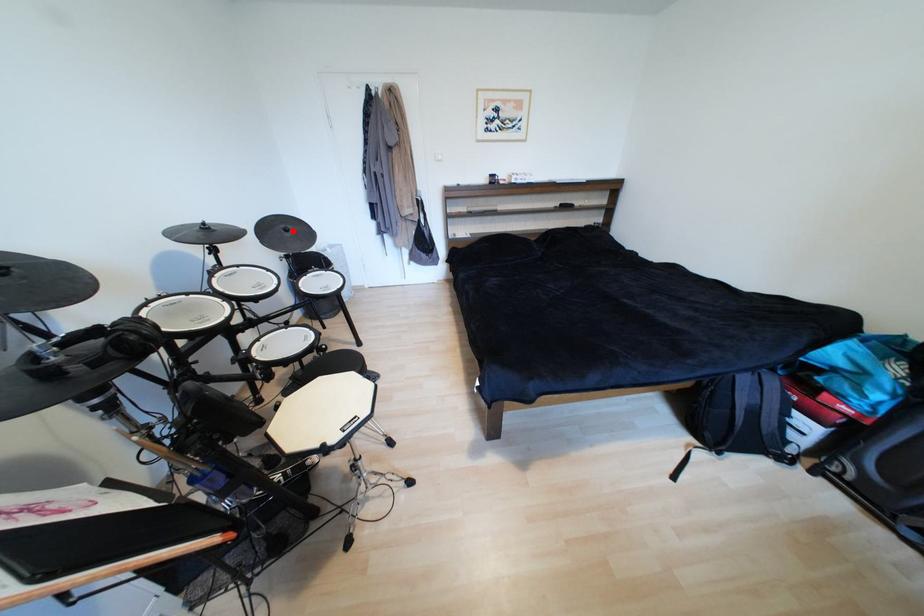
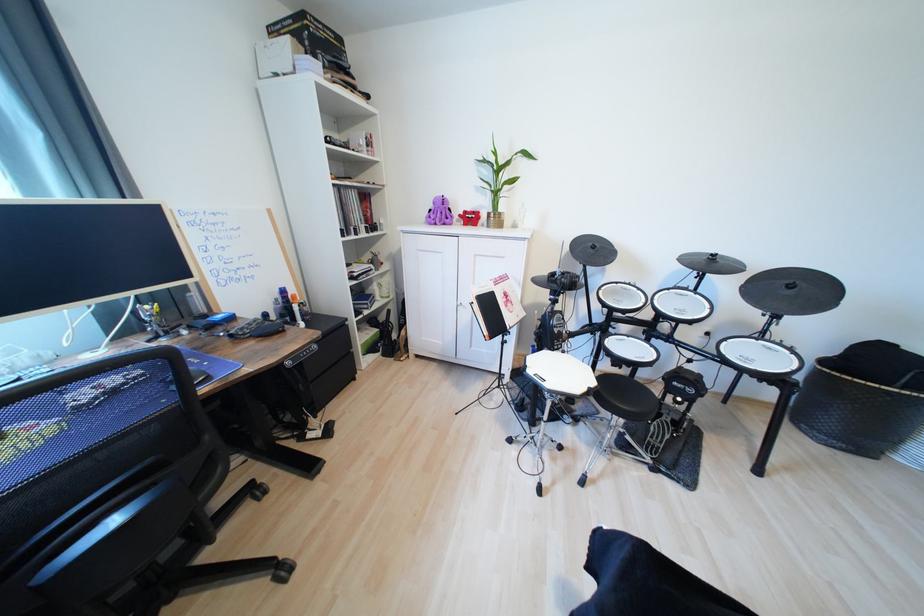
Question: I am providing you with two images of the same scene from different viewpoints. Image1 has a red point marked. In image2, the corresponding 3D location appears at what relative position? Reply with the corresponding letter.

Choices:
 (A) Closer
 (B) Farther

Answer: (B)